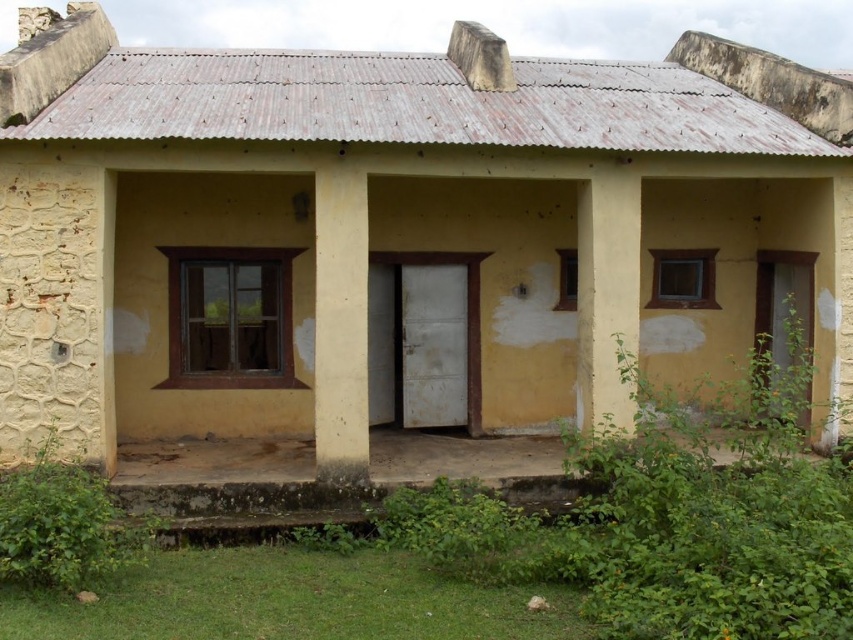
Consider the image. Which of these two, white smooth pillar at center or yellow matte pillar at center, stands shorter?

yellow matte pillar at center

Which is in front, point (363, 412) or point (622, 173)?

Point (363, 412) is in front.

Is point (328, 282) less distant than point (601, 225)?

Yes, point (328, 282) is closer to viewer.

Locate an element on the screen. This screenshot has width=853, height=640. white smooth pillar at center is located at coordinates (340, 324).